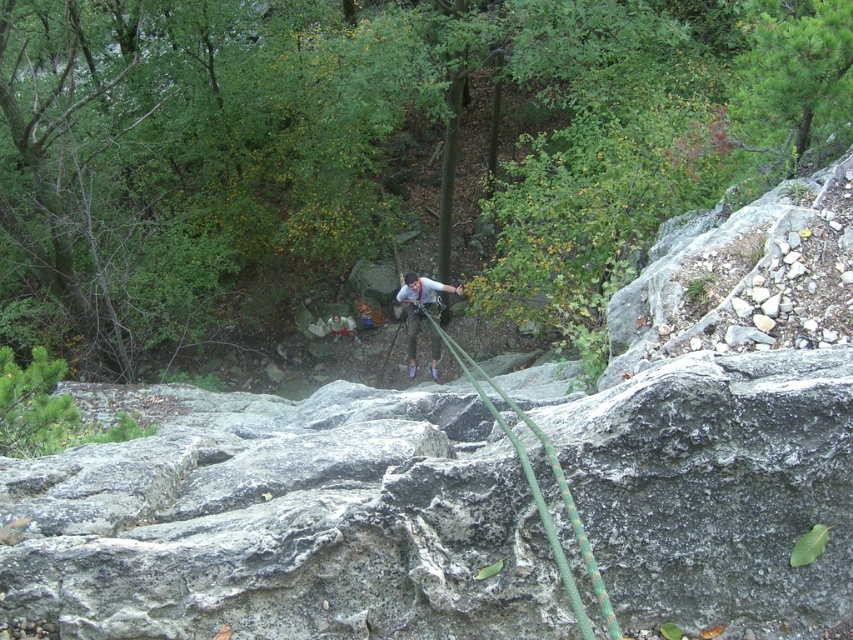
You are a rock climber preparing to ascend the rock face. You notice the gray rough rock at center and the matte gray climbing harness at center. Which object is positioned higher on the rock face?

The matte gray climbing harness at center is positioned higher on the rock face than the gray rough rock at center, as it is taller than it.